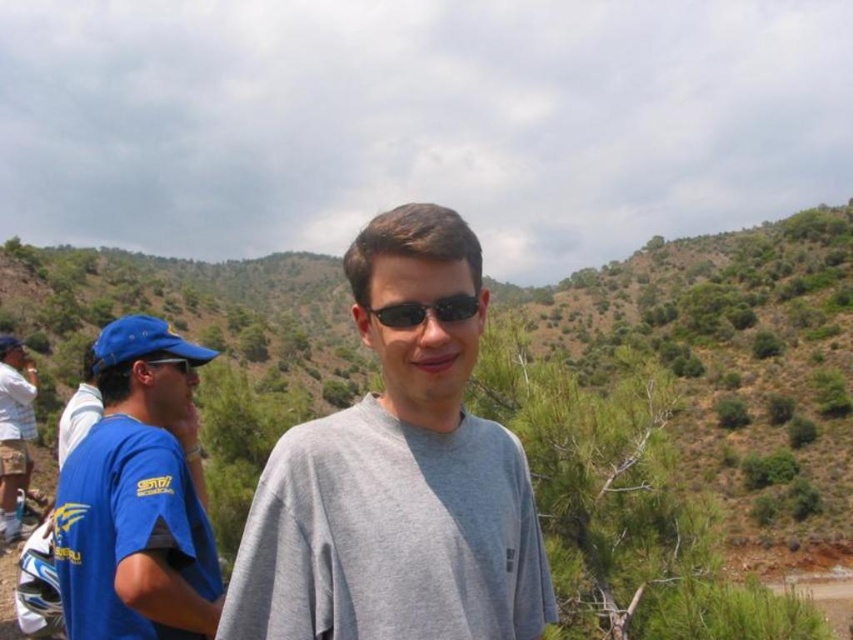
Question: Which object is positioned closest to the blue fabric cap at left?

Choices:
 (A) black plastic goggles at left
 (B) gray matte shirt at center
 (C) black plastic sunglasses at center

Answer: (A)

Question: Where is black plastic sunglasses at center located in relation to black plastic goggles at left in the image?

Choices:
 (A) above
 (B) below

Answer: (A)

Question: Which point is farther from the camera taking this photo?

Choices:
 (A) (474, 301)
 (B) (111, 468)
 (C) (4, 362)
 (D) (398, 403)

Answer: (C)

Question: Does blue fabric cap at left appear on the right side of black plastic sunglasses at center?

Choices:
 (A) yes
 (B) no

Answer: (B)

Question: From the image, what is the correct spatial relationship of black plastic sunglasses at center in relation to black plastic goggles at left?

Choices:
 (A) above
 (B) below

Answer: (A)

Question: Which object is farther from the camera taking this photo?

Choices:
 (A) black plastic sunglasses at center
 (B) white cotton shirt at left

Answer: (B)